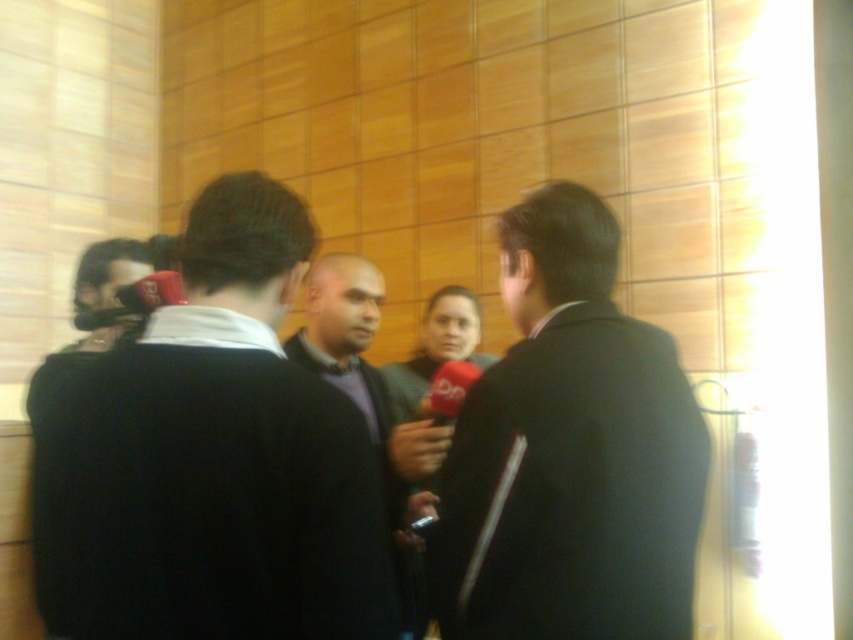
Consider the image. Can you confirm if dark gray sweater at center is positioned to the right of dark suit jacket at center?

Incorrect, dark gray sweater at center is not on the right side of dark suit jacket at center.

Is point (323, 627) more distant than point (511, 376)?

No, it is not.

This screenshot has width=853, height=640. In order to click on dark gray sweater at center in this screenshot , I will do `click(212, 460)`.

Based on the photo, which is above, dark suit jacket at center or dark gray wool sweater at center?

dark suit jacket at center is above.

Which of these two, dark suit jacket at center or dark gray wool sweater at center, stands taller?

With more height is dark gray wool sweater at center.

Find the location of a particular element. This screenshot has height=640, width=853. dark suit jacket at center is located at coordinates (570, 452).

Which of these two, dark suit jacket at center or matte black camera at left, stands shorter?

matte black camera at left

Does dark suit jacket at center lie in front of matte black camera at left?

Yes, it is in front of matte black camera at left.

Measure the distance between point (538, 522) and camera.

The distance of point (538, 522) from camera is 91.37 centimeters.

Where is `dark suit jacket at center`? dark suit jacket at center is located at coordinates (570, 452).